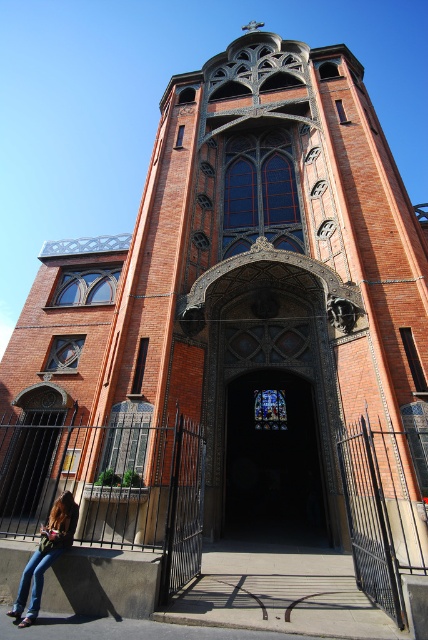
Question: Among these objects, which one is nearest to the camera?

Choices:
 (A) smooth concrete ledge at lower left
 (B) denim jeans at lower left
 (C) dark stained glass door at center

Answer: (B)

Question: Does dark stained glass door at center appear on the right side of smooth concrete ledge at lower left?

Choices:
 (A) no
 (B) yes

Answer: (B)

Question: Is dark stained glass door at center bigger than smooth concrete ledge at lower left?

Choices:
 (A) no
 (B) yes

Answer: (B)

Question: Which of these objects is positioned farthest from the smooth concrete ledge at lower left?

Choices:
 (A) denim jeans at lower left
 (B) dark stained glass door at center

Answer: (B)

Question: Can you confirm if smooth concrete ledge at lower left is positioned below denim jeans at lower left?

Choices:
 (A) yes
 (B) no

Answer: (B)

Question: Which of these objects is positioned farthest from the smooth concrete ledge at lower left?

Choices:
 (A) dark stained glass door at center
 (B) denim jeans at lower left

Answer: (A)